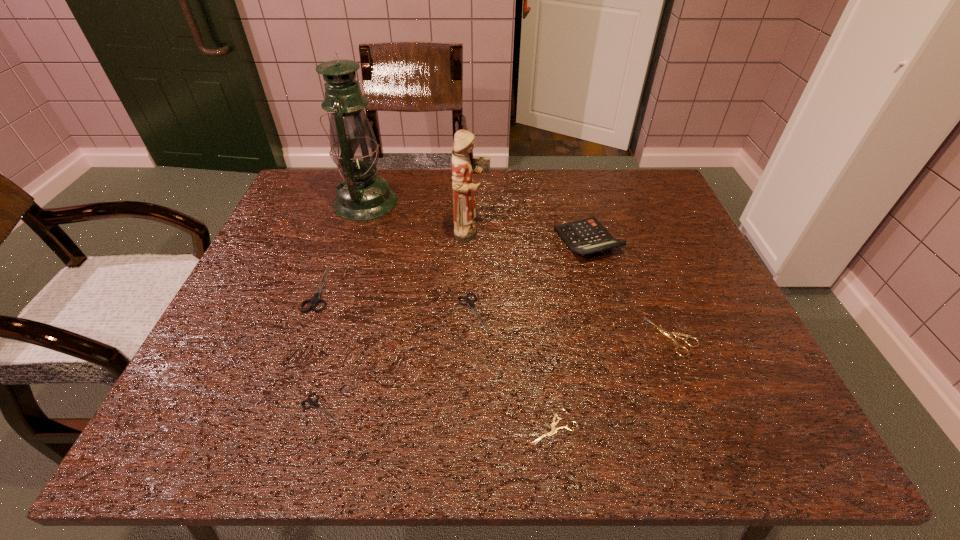
Locate an element on the screen. The height and width of the screenshot is (540, 960). the nearest black shears is located at coordinates (313, 404).

The height and width of the screenshot is (540, 960). Identify the location of the shortest object. (554, 430).

This screenshot has width=960, height=540. Find the location of `the smaller beige shears`. the smaller beige shears is located at coordinates (554, 430).

Image resolution: width=960 pixels, height=540 pixels. What are the coordinates of `vacant space located on the right of the tallest object` in the screenshot? It's located at (517, 202).

The width and height of the screenshot is (960, 540). I want to click on vacant space located 0.260m on the front-facing side of the second tallest object, so click(x=586, y=232).

This screenshot has height=540, width=960. I want to click on vacant area situated 0.130m on the left of the calculator, so click(x=507, y=241).

Identify the location of free region located on the back of the fourth tallest object. This screenshot has width=960, height=540. (349, 207).

Identify the location of free space located on the front of the fourth shortest shears. (471, 404).

Where is `vacant space located on the left of the right beige shears`? vacant space located on the left of the right beige shears is located at coordinates (611, 336).

Where is `blank area located 0.400m on the back of the second black shears from left to right`? The width and height of the screenshot is (960, 540). blank area located 0.400m on the back of the second black shears from left to right is located at coordinates (366, 255).